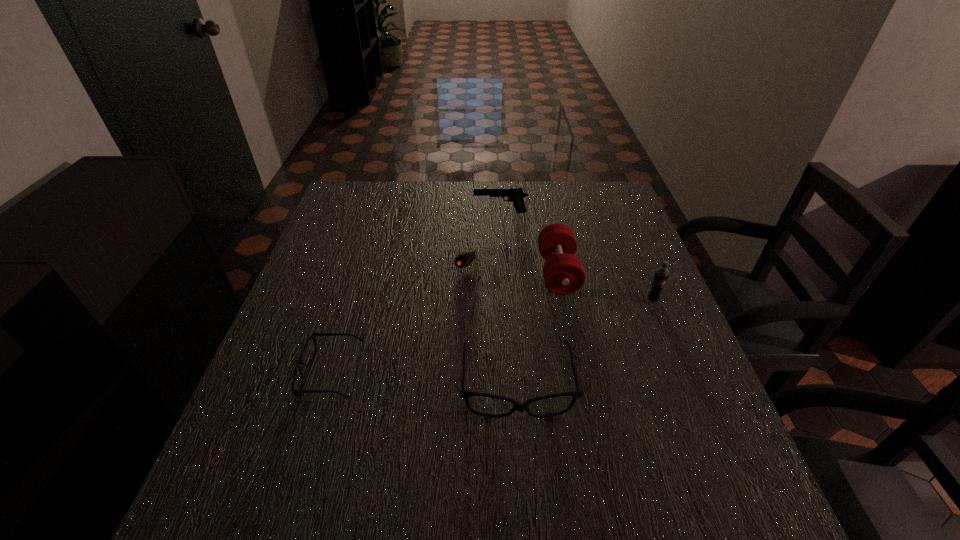
Find the location of a particular element. The width and height of the screenshot is (960, 540). the shorter spectacles is located at coordinates (314, 334).

At what (x,y) coordinates should I click in order to perform the action: click on the fifth tallest object. Please return your answer as a coordinate pair (x, y). Image resolution: width=960 pixels, height=540 pixels. Looking at the image, I should click on (314, 334).

Image resolution: width=960 pixels, height=540 pixels. I want to click on the taller spectacles, so click(x=465, y=395).

In order to click on the third shortest object in this screenshot , I will do click(465, 395).

Find the location of a particular element. The height and width of the screenshot is (540, 960). the farthest object is located at coordinates (515, 195).

The height and width of the screenshot is (540, 960). In order to click on computer mouse in this screenshot , I will do `click(465, 258)`.

The height and width of the screenshot is (540, 960). What are the coordinates of `the rightmost object` in the screenshot? It's located at (661, 275).

The image size is (960, 540). What are the coordinates of `the tallest object` in the screenshot? It's located at (661, 275).

Where is `dumbbell`? dumbbell is located at coordinates (563, 272).

In order to click on free spot located on the front-facing side of the left spectacles in this screenshot , I will do `click(272, 374)`.